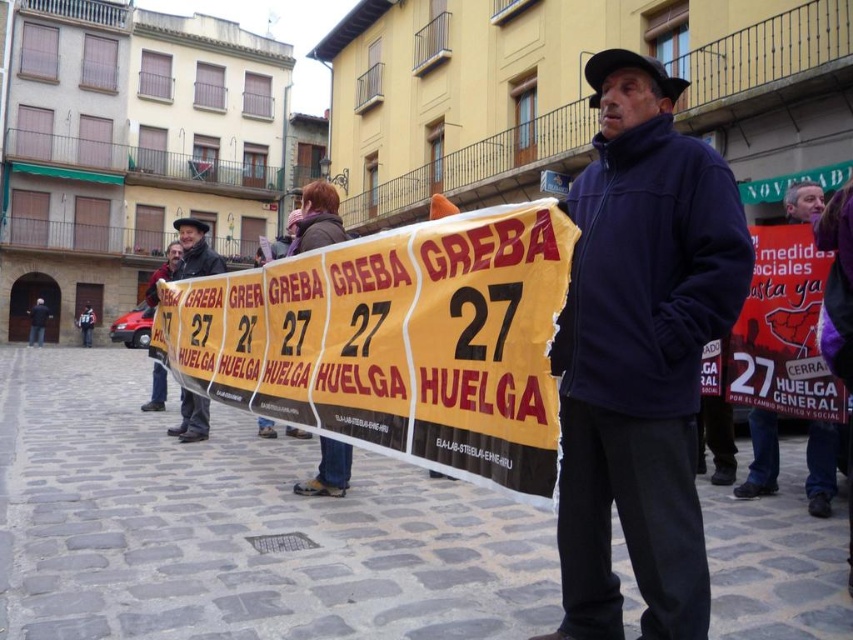
This screenshot has height=640, width=853. Identify the location of matte black jacket at center. (821, 467).

Does matte black jacket at center appear on the left side of matte black jacket at left?

In fact, matte black jacket at center is to the right of matte black jacket at left.

Find the location of a particular element. This screenshot has height=640, width=853. matte black jacket at center is located at coordinates (821, 467).

Is navy blue fleece jacket at center positioned at the back of matte black jacket at left?

No, navy blue fleece jacket at center is closer to the viewer.

Does point (639, 376) come behind point (206, 262)?

That is False.

The height and width of the screenshot is (640, 853). Find the location of `navy blue fleece jacket at center`. navy blue fleece jacket at center is located at coordinates (640, 353).

Locate an element on the screen. This screenshot has height=640, width=853. navy blue fleece jacket at center is located at coordinates point(640,353).

Does yellow paper banner at center have a greater width compared to navy blue fleece jacket at center?

Indeed, yellow paper banner at center has a greater width compared to navy blue fleece jacket at center.

Who is positioned more to the left, yellow paper banner at center or navy blue fleece jacket at center?

Positioned to the left is yellow paper banner at center.

Between point (526, 474) and point (566, 524), which one is positioned in front?

Point (526, 474) is more forward.

Image resolution: width=853 pixels, height=640 pixels. In order to click on yellow paper banner at center in this screenshot , I will do `click(396, 342)`.